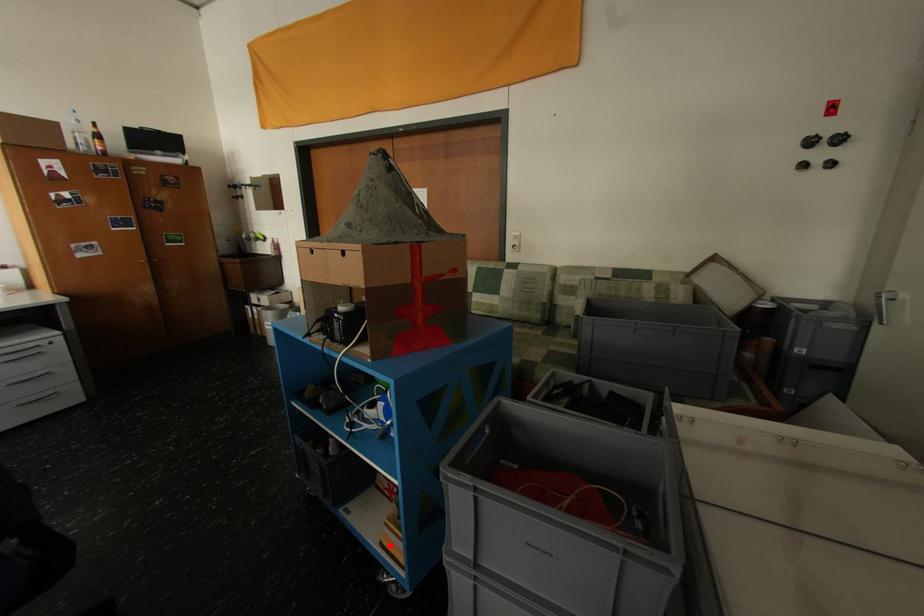
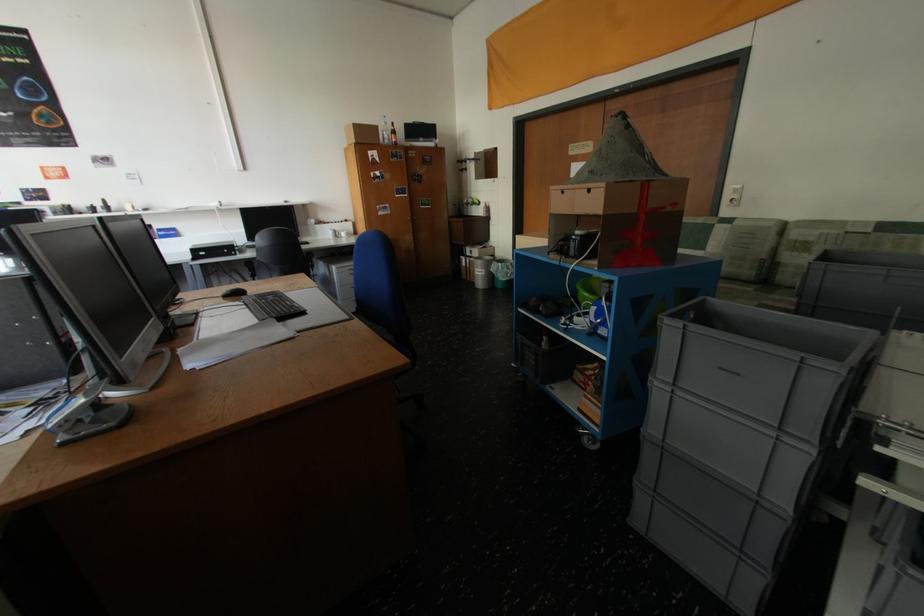
Question: I am providing you with two images of the same scene from different viewpoints. In image1, a red point is highlighted. Considering the same 3D point in image2, which of the following is correct?

Choices:
 (A) It is closer
 (B) It is farther

Answer: (A)